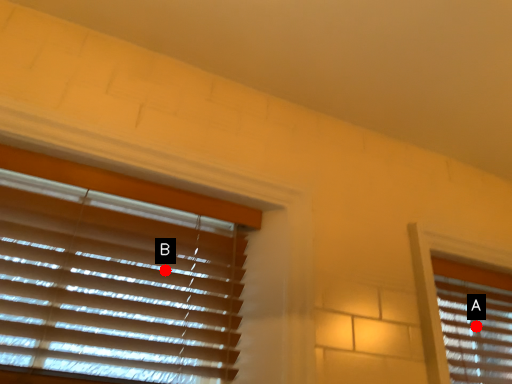
Question: Two points are circled on the image, labeled by A and B beside each circle. Which point appears farthest from the camera in this image?

Choices:
 (A) A is further
 (B) B is further

Answer: (A)